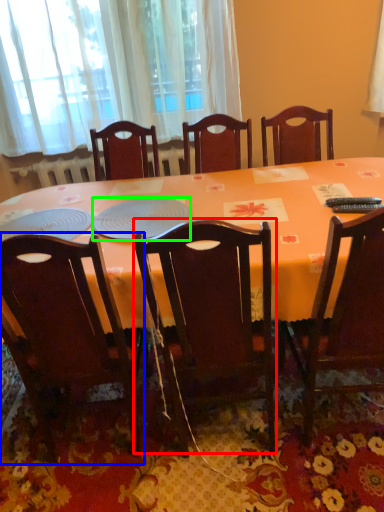
Question: Which object is positioned closest to chair (highlighted by a red box)? Select from chair (highlighted by a blue box) and platter (highlighted by a green box).

Choices:
 (A) chair
 (B) platter

Answer: (A)